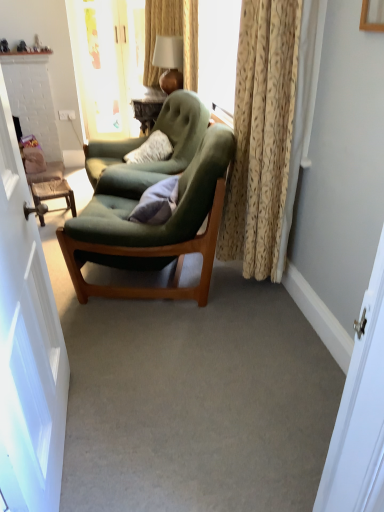
Question: From the image's perspective, does beige textured curtain at right appear lower than velvet green armchair at center, which is the first chair in back-to-front order?

Choices:
 (A) yes
 (B) no

Answer: (A)

Question: Is the depth of beige textured curtain at right less than that of velvet green armchair at center, the 2th chair from the front?

Choices:
 (A) no
 (B) yes

Answer: (B)

Question: Does beige textured curtain at right have a larger size compared to velvet green armchair at center, which is the first chair in back-to-front order?

Choices:
 (A) yes
 (B) no

Answer: (B)

Question: Considering the relative sizes of beige textured curtain at right and velvet green armchair at center, which is the first chair in back-to-front order, in the image provided, is beige textured curtain at right wider than velvet green armchair at center, which is the first chair in back-to-front order,?

Choices:
 (A) no
 (B) yes

Answer: (A)

Question: Does beige textured curtain at right appear on the left side of velvet green armchair at center, the 2th chair from the front?

Choices:
 (A) no
 (B) yes

Answer: (A)

Question: Considering the positions of point (175, 57) and point (170, 181), is point (175, 57) closer or farther from the camera than point (170, 181)?

Choices:
 (A) closer
 (B) farther

Answer: (B)

Question: Based on their sizes in the image, would you say matte gold lamp at upper center is bigger or smaller than gray fabric pillow at center?

Choices:
 (A) big
 (B) small

Answer: (A)

Question: Would you say matte gold lamp at upper center is to the left or to the right of gray fabric pillow at center in the picture?

Choices:
 (A) right
 (B) left

Answer: (A)

Question: Looking at their shapes, would you say matte gold lamp at upper center is wider or thinner than gray fabric pillow at center?

Choices:
 (A) thin
 (B) wide

Answer: (B)

Question: In terms of width, does gray fabric pillow at center look wider or thinner when compared to velvet green armchair at center, which is the first chair in back-to-front order?

Choices:
 (A) thin
 (B) wide

Answer: (A)

Question: Which is correct: gray fabric pillow at center is inside velvet green armchair at center, which is the first chair in back-to-front order, or outside of it?

Choices:
 (A) outside
 (B) inside

Answer: (A)

Question: Is gray fabric pillow at center in front of or behind velvet green armchair at center, which is the first chair in back-to-front order, in the image?

Choices:
 (A) front
 (B) behind

Answer: (A)

Question: Based on their positions, is gray fabric pillow at center located to the left or right of velvet green armchair at center, the 2th chair from the front?

Choices:
 (A) left
 (B) right

Answer: (B)

Question: Is matte gold lamp at upper center wider or thinner than velvet green armchair at center, which is the first chair in back-to-front order?

Choices:
 (A) thin
 (B) wide

Answer: (A)

Question: Is point (172, 53) positioned closer to the camera than point (167, 163)?

Choices:
 (A) closer
 (B) farther

Answer: (B)